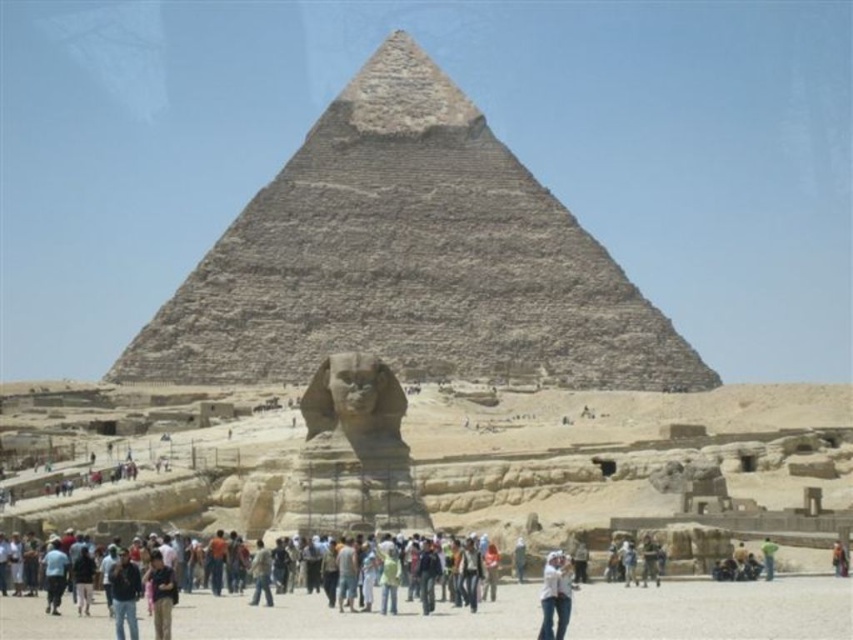
Question: Observing the image, what is the correct spatial positioning of granite pyramid at center in reference to dark blue shirt at lower left?

Choices:
 (A) left
 (B) right

Answer: (A)

Question: Which of the following is the closest to the observer?

Choices:
 (A) granite pyramid at center
 (B) dark blue shirt at lower left

Answer: (B)

Question: Which of the following is the closest to the observer?

Choices:
 (A) (163, 579)
 (B) (381, 216)

Answer: (A)

Question: Is granite pyramid at center in front of dark blue shirt at lower left?

Choices:
 (A) yes
 (B) no

Answer: (B)

Question: Does granite pyramid at center have a larger size compared to dark blue shirt at lower left?

Choices:
 (A) yes
 (B) no

Answer: (A)